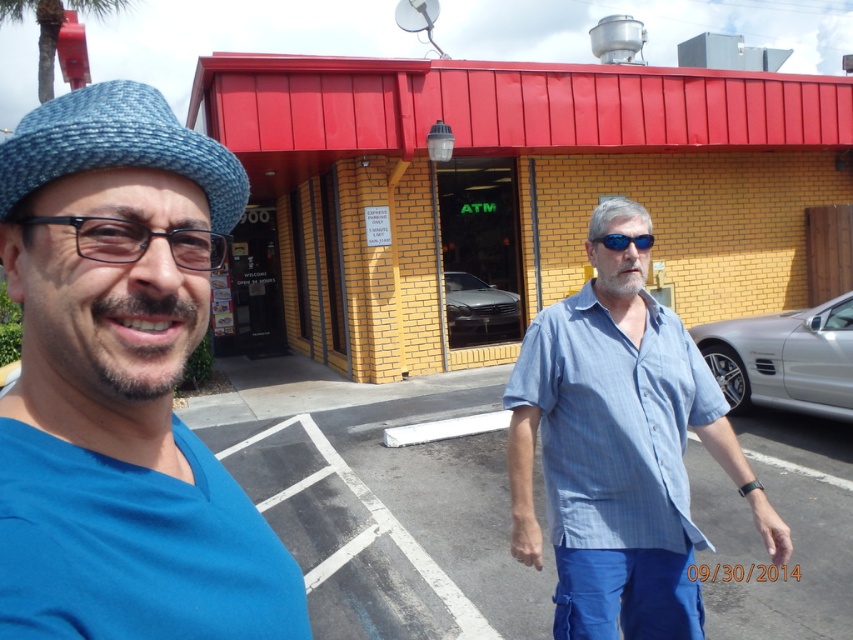
You are a photographer trying to capture a clear shot of the blue cotton shirt at center and the blue reflective sunglasses at center. Which object should you focus on first to ensure both are in focus?

The blue cotton shirt at center is closer to the viewer than the blue reflective sunglasses at center, so focus on the blue cotton shirt at center first. This way, adjusting the focus slightly backward can also capture the blue reflective sunglasses at center in focus.

You are a security guard at the financial institution shown in the image. You need to verify the clothing items of two people standing at the center. Which clothing item is located lower on their bodies between the blue cotton shirt at center and the blue reflective sunglasses at center?

The blue cotton shirt at center is positioned under the blue reflective sunglasses at center, so the blue cotton shirt at center is located lower on their bodies.